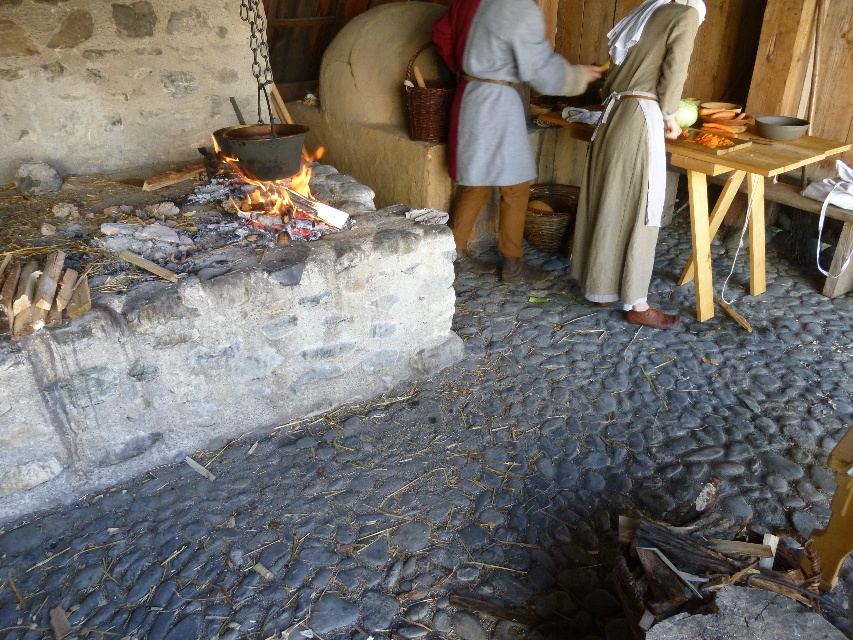
Which is behind, point (637, 218) or point (479, 13)?

Positioned behind is point (479, 13).

Is light brown linen robe at center wider than gray woolen robe at center?

In fact, light brown linen robe at center might be narrower than gray woolen robe at center.

The width and height of the screenshot is (853, 640). Describe the element at coordinates (631, 150) in the screenshot. I see `light brown linen robe at center` at that location.

You are a GUI agent. You are given a task and a screenshot of the screen. Output one action in this format:
    pyautogui.click(x=<x>, y=<y>)
    Task: Click on the light brown linen robe at center
    Image resolution: width=853 pixels, height=640 pixels.
    Given the screenshot: What is the action you would take?
    pyautogui.click(x=631, y=150)